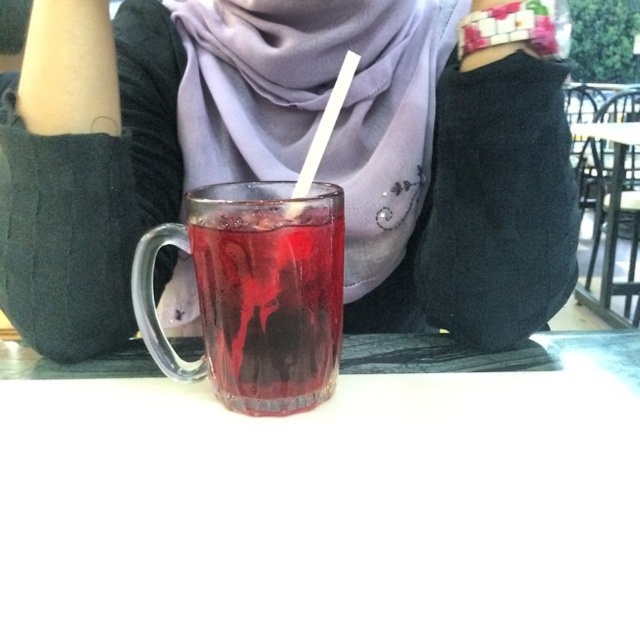
Is point (369, 209) behind point (333, 104)?

Yes, point (369, 209) is behind point (333, 104).

Is matte purple scarf at center above white plastic straw at center?

Yes.

You are a GUI agent. You are given a task and a screenshot of the screen. Output one action in this format:
    pyautogui.click(x=<x>, y=<y>)
    Task: Click on the matte purple scarf at center
    This screenshot has width=640, height=640.
    Given the screenshot: What is the action you would take?
    pyautogui.click(x=317, y=106)

Where is `matte purple scarf at center`? The width and height of the screenshot is (640, 640). matte purple scarf at center is located at coordinates (317, 106).

Which is in front, point (74, 72) or point (348, 81)?

Positioned in front is point (348, 81).

Does point (476, 116) come in front of point (355, 65)?

No, it is behind (355, 65).

Which is in front, point (502, 72) or point (337, 93)?

Point (337, 93) is in front.

I want to click on matte glass mug at center, so click(x=294, y=154).

Looking at this image, does matte purple scarf at center have a lesser width compared to translucent glass at center?

Incorrect, matte purple scarf at center's width is not less than translucent glass at center's.

Is point (397, 88) in front of point (192, 248)?

No, it is not.

Locate an element on the screen. The image size is (640, 640). matte purple scarf at center is located at coordinates (317, 106).